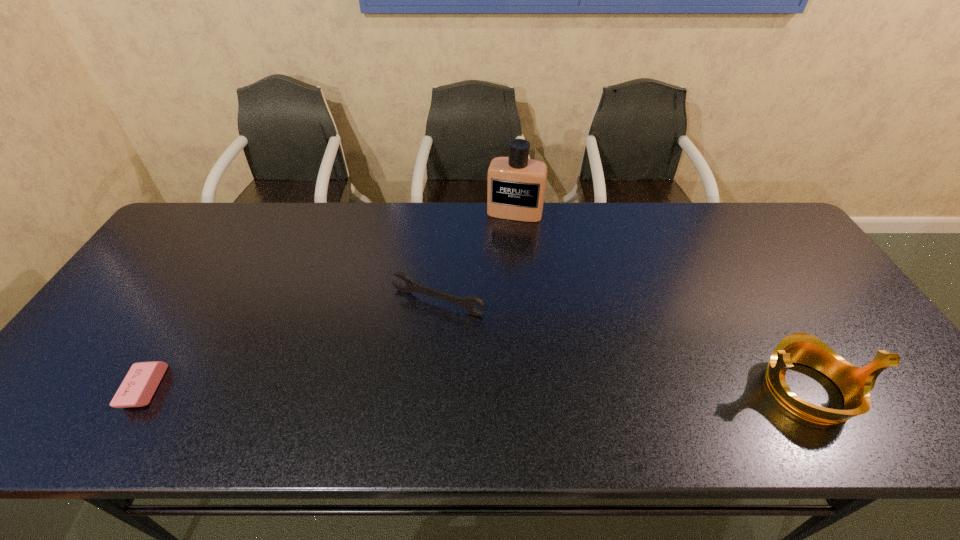
The width and height of the screenshot is (960, 540). I want to click on free area in between the second object from right to left and the rightmost object, so click(x=661, y=301).

Identify the location of free spot between the tallest object and the third tallest object. This screenshot has width=960, height=540. (476, 258).

Locate an element on the screen. The height and width of the screenshot is (540, 960). vacant space in between the leftmost object and the wrench is located at coordinates (292, 346).

Locate an element on the screen. This screenshot has height=540, width=960. free spot between the rightmost object and the eraser is located at coordinates (477, 389).

At what (x,y) coordinates should I click in order to perform the action: click on free space between the tiara and the third object from right to left. Please return your answer as a coordinate pair (x, y). Looking at the image, I should click on (623, 346).

Locate an element on the screen. The height and width of the screenshot is (540, 960). vacant region between the leftmost object and the rightmost object is located at coordinates (477, 389).

At what (x,y) coordinates should I click in order to perform the action: click on the closest object to the shortest object. Please return your answer as a coordinate pair (x, y). This screenshot has width=960, height=540. Looking at the image, I should click on (467, 303).

Image resolution: width=960 pixels, height=540 pixels. In order to click on object that is the third closest to the third tallest object in this screenshot , I will do `click(855, 383)`.

Where is `vacant area in the image that satisfies the following two spatial constraints: 1. on the front side of the second tallest object; 2. at the front emblem of the second object from right to left`? This screenshot has height=540, width=960. vacant area in the image that satisfies the following two spatial constraints: 1. on the front side of the second tallest object; 2. at the front emblem of the second object from right to left is located at coordinates (531, 390).